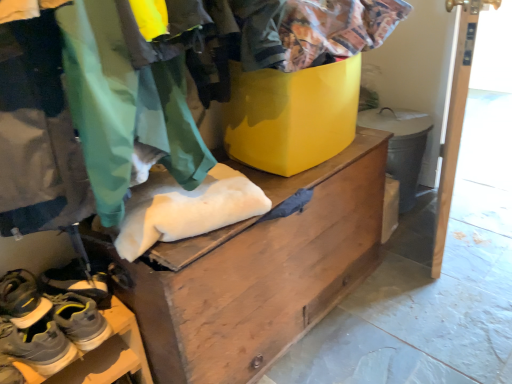
You are a GUI agent. You are given a task and a screenshot of the screen. Output one action in this format:
    pyautogui.click(x=<x>, y=<y>)
    Task: Click on the vacant region in front of white wood door at right
    
    Given the screenshot: What is the action you would take?
    pyautogui.click(x=452, y=297)